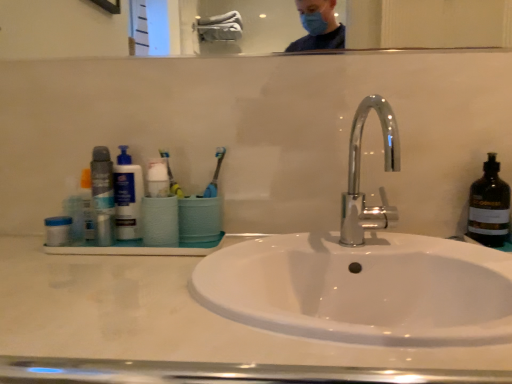
In order to face white glossy sink at center, should I rotate leftwards or rightwards?

To face it directly, rotate left by 7.410 degrees.

What is the approximate width of yellow rubber toothbrush at center?

The width of yellow rubber toothbrush at center is 0.96 inches.

The image size is (512, 384). What do you see at coordinates (170, 176) in the screenshot?
I see `yellow rubber toothbrush at center` at bounding box center [170, 176].

Where is `matte black deodorant at left`? Image resolution: width=512 pixels, height=384 pixels. matte black deodorant at left is located at coordinates (x=102, y=195).

In order to face matte black deodorant at left, should I rotate leftwards or rightwards?

You should rotate left by 19.996 degrees.

Locate an element on the screen. The height and width of the screenshot is (384, 512). chrome/metallic faucet at center is located at coordinates (359, 174).

What do you see at coordinates (127, 197) in the screenshot? Image resolution: width=512 pixels, height=384 pixels. I see `matte plastic bottle at left` at bounding box center [127, 197].

Locate an element on the screen. This screenshot has height=384, width=512. matte plastic bottle at left is located at coordinates (127, 197).

You are a GUI agent. You are given a task and a screenshot of the screen. Output one action in this format:
    pyautogui.click(x=<x>, y=<y>)
    Task: Click on the white glossy sink at center
    The height and width of the screenshot is (384, 512).
    Given the screenshot: What is the action you would take?
    pyautogui.click(x=178, y=331)

From a real-world perspective, which object stands above the other?

clear glass mirror at upper center, from a real-world perspective.

Is point (336, 365) farther from camera compared to point (282, 19)?

No, (336, 365) is closer to viewer.

From the image's perspective, is white glossy sink at center under clear glass mirror at upper center?

Yes, from the image's perspective, white glossy sink at center is below clear glass mirror at upper center.

Is white glossy sink at center wider or thinner than clear glass mirror at upper center?

white glossy sink at center is wider than clear glass mirror at upper center.

Which of these two, clear glass mirror at upper center or blue plastic container at left, is thinner?

With smaller width is clear glass mirror at upper center.

Considering the relative sizes of clear glass mirror at upper center and blue plastic container at left in the image provided, is clear glass mirror at upper center smaller than blue plastic container at left?

No, clear glass mirror at upper center is not smaller than blue plastic container at left.

Does clear glass mirror at upper center come behind blue plastic container at left?

Yes, clear glass mirror at upper center is behind blue plastic container at left.

Between clear glass mirror at upper center and blue plastic container at left, which one has less height?

blue plastic container at left.

From the image's perspective, would you say white glossy sink at center is shown under yellow rubber toothbrush at center?

Yes.

Identify the location of counter top that appears below the yellow rubber toothbrush at center (from a real-world perspective). (178, 331).

Between white glossy sink at center and yellow rubber toothbrush at center, which one has smaller width?

Thinner between the two is yellow rubber toothbrush at center.

Does white glossy sink at center have a lesser height compared to yellow rubber toothbrush at center?

In fact, white glossy sink at center may be taller than yellow rubber toothbrush at center.

From the picture: Considering the relative sizes of yellow rubber toothbrush at center and clear glass mirror at upper center in the image provided, is yellow rubber toothbrush at center bigger than clear glass mirror at upper center?

No.

From the image's perspective, is yellow rubber toothbrush at center beneath clear glass mirror at upper center?

Yes.

Do you think yellow rubber toothbrush at center is within clear glass mirror at upper center, or outside of it?

yellow rubber toothbrush at center is not enclosed by clear glass mirror at upper center.

Which is closer to the camera, (170, 180) or (492, 33)?

Clearly, point (170, 180) is closer to the camera than point (492, 33).

Which is more to the left, matte black deodorant at left or matte plastic bottle at left?

matte black deodorant at left.

Based on the photo, in terms of width, does matte black deodorant at left look wider or thinner when compared to matte plastic bottle at left?

In the image, matte black deodorant at left appears to be wider than matte plastic bottle at left.

Is point (111, 238) more distant than point (117, 180)?

Yes.

Is matte black deodorant at left not inside matte plastic bottle at left?

Yes, matte black deodorant at left is not within matte plastic bottle at left.

In the image, is matte plastic bottle at left positioned in front of or behind chrome/metallic faucet at center?

matte plastic bottle at left is behind chrome/metallic faucet at center.

Locate an element on the screen. This screenshot has height=384, width=512. cleaning product below the chrome/metallic faucet at center (from a real-world perspective) is located at coordinates (127, 197).

Based on the photo, does matte plastic bottle at left have a larger size compared to chrome/metallic faucet at center?

No.

Which of these two, matte plastic bottle at left or chrome/metallic faucet at center, stands shorter?

With less height is matte plastic bottle at left.

From the image's perspective, which one is positioned higher, blue plastic container at left or matte plastic bottle at left?

matte plastic bottle at left appears higher in the image.

From a real-world perspective, between blue plastic container at left and matte plastic bottle at left, who is vertically lower?

From a 3D spatial view, blue plastic container at left is below.

The width and height of the screenshot is (512, 384). I want to click on cleaning product on the right of blue plastic container at left, so click(127, 197).

Between blue plastic container at left and matte plastic bottle at left, which one has smaller width?

blue plastic container at left is thinner.

The image size is (512, 384). Find the location of `counter top that is below the clear glass mirror at upper center (from the image's perspective)`. counter top that is below the clear glass mirror at upper center (from the image's perspective) is located at coordinates (178, 331).

The height and width of the screenshot is (384, 512). I want to click on mouthwash that is in front of the clear glass mirror at upper center, so click(57, 230).

Looking at the image, which one is located further to yellow rubber toothbrush at center, blue plastic container at left or clear glass mirror at upper center?

Among the two, clear glass mirror at upper center is located further to yellow rubber toothbrush at center.

Based on the photo, considering their positions, is clear glass mirror at upper center positioned further to chrome/metallic faucet at center than white glossy sink at center?

Based on the image, clear glass mirror at upper center appears to be further to chrome/metallic faucet at center.

From the image, which object appears to be nearer to matte black deodorant at left, yellow rubber toothbrush at center or blue plastic container at left?

blue plastic container at left is closer to matte black deodorant at left.

When comparing their distances from blue plastic container at left, does chrome/metallic faucet at center or matte black deodorant at left seem further?

chrome/metallic faucet at center lies further to blue plastic container at left than the other object.

Looking at the image, which one is located further to blue plastic container at left, matte black deodorant at left or clear glass mirror at upper center?

The object further to blue plastic container at left is clear glass mirror at upper center.

From the image, which object appears to be farther from matte black deodorant at left, white glossy sink at center or matte plastic bottle at left?

white glossy sink at center lies further to matte black deodorant at left than the other object.

Looking at this image, based on their spatial positions, is clear glass mirror at upper center or white glossy sink at center further from matte black deodorant at left?

clear glass mirror at upper center.

Based on their spatial positions, is blue plastic container at left or white glossy sink at center further from matte plastic bottle at left?

white glossy sink at center is further to matte plastic bottle at left.

Locate an element on the screen. tap located between white glossy sink at center and matte plastic bottle at left in the depth direction is located at coordinates (359, 174).

You are a GUI agent. You are given a task and a screenshot of the screen. Output one action in this format:
    pyautogui.click(x=<x>, y=<y>)
    Task: Click on the cleaning product between blue plastic container at left and chrome/metallic faucet at center from left to right
    This screenshot has width=512, height=384.
    Given the screenshot: What is the action you would take?
    pyautogui.click(x=127, y=197)

At what (x,y) coordinates should I click in order to perform the action: click on mirror between matte black deodorant at left and chrome/metallic faucet at center in the horizontal direction. Please return your answer as a coordinate pair (x, y). This screenshot has width=512, height=384. Looking at the image, I should click on (429, 23).

The image size is (512, 384). What are the coordinates of `toothbrush between matte black deodorant at left and chrome/metallic faucet at center from left to right` in the screenshot? It's located at (170, 176).